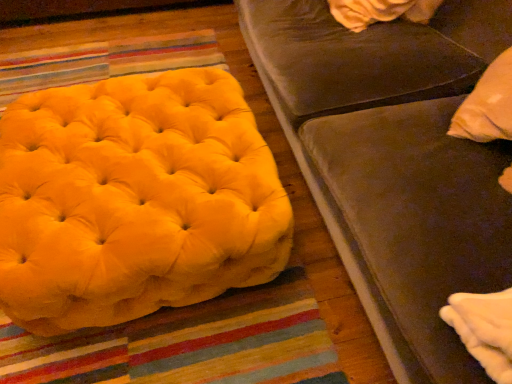
Image resolution: width=512 pixels, height=384 pixels. What are the coordinates of `vacant space situated above yellow velvet ottoman at left (from a real-world perspective)` in the screenshot? It's located at (112, 146).